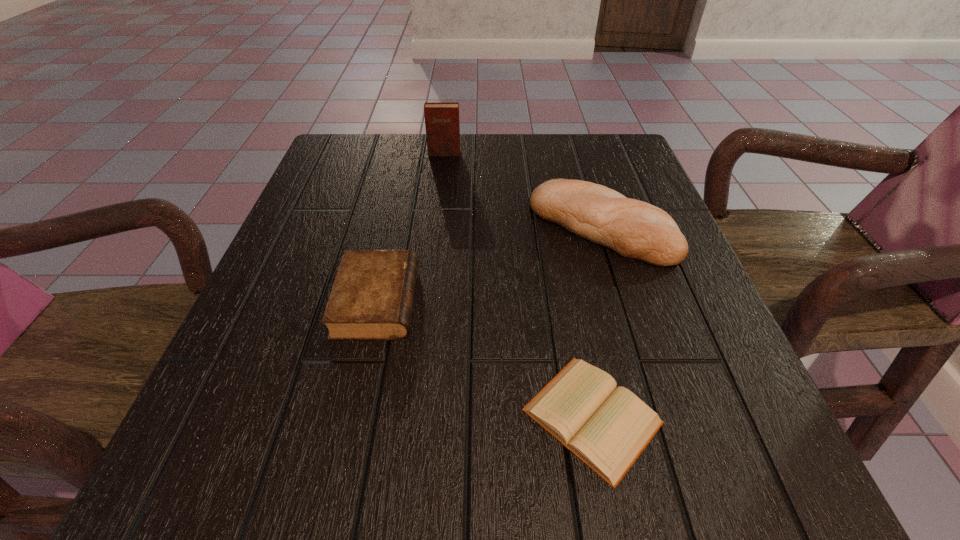
You are a GUI agent. You are given a task and a screenshot of the screen. Output one action in this format:
    pyautogui.click(x=<x>, y=<y>)
    Task: Click on the vacant space located on the back of the shortest diary
    The image size is (960, 540).
    Given the screenshot: What is the action you would take?
    pyautogui.click(x=564, y=266)

This screenshot has height=540, width=960. What are the coordinates of `object at the far edge` in the screenshot? It's located at (442, 126).

You are a GUI agent. You are given a task and a screenshot of the screen. Output one action in this format:
    pyautogui.click(x=<x>, y=<y>)
    Task: Click on the object that is positioned at the near edge
    This screenshot has height=540, width=960.
    Given the screenshot: What is the action you would take?
    pyautogui.click(x=606, y=427)

The image size is (960, 540). Identify the location of object that is at the left edge. (372, 296).

Where is `bread at the right edge`? This screenshot has height=540, width=960. bread at the right edge is located at coordinates (634, 229).

Locate an element on the screen. Image resolution: width=960 pixels, height=540 pixels. diary positioned at the right edge is located at coordinates (606, 427).

Identify the location of object that is at the near right corner. The image size is (960, 540). (606, 427).

This screenshot has height=540, width=960. I want to click on vacant region at the far edge of the desktop, so click(x=416, y=152).

Find the location of a particular element. The height and width of the screenshot is (540, 960). free space at the right edge of the desktop is located at coordinates (681, 327).

Find the location of a particular element. vacant space at the far left corner is located at coordinates (344, 154).